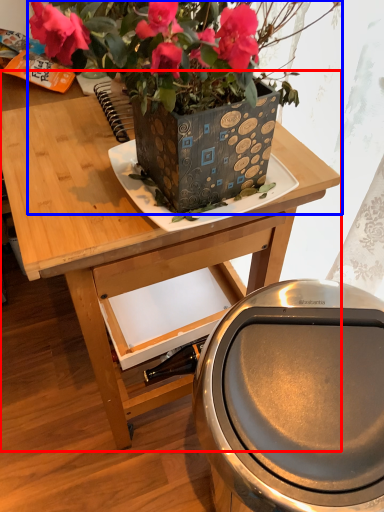
Question: Which of the following is the closest to the observer, table (highlighted by a red box) or houseplant (highlighted by a blue box)?

Choices:
 (A) table
 (B) houseplant

Answer: (B)